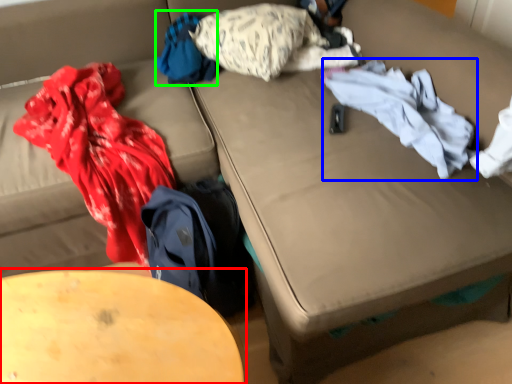
Question: Considering the real-world distances, which object is farthest from table (highlighted by a red box)? clothing (highlighted by a blue box) or clothing (highlighted by a green box)?

Choices:
 (A) clothing
 (B) clothing

Answer: (B)